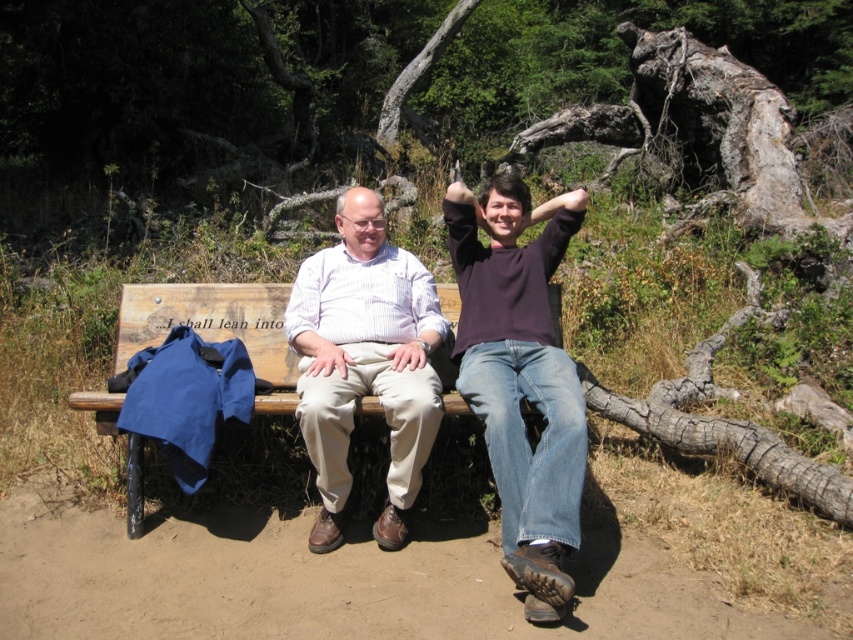
Question: Can you confirm if matte brown shirt at center is wider than light brown cotton shirt at center?

Choices:
 (A) yes
 (B) no

Answer: (A)

Question: Which of these objects is positioned farthest from the matte brown shirt at center?

Choices:
 (A) wooden bench at center
 (B) dark purple sweater at upper center

Answer: (A)

Question: Is dark purple sweater at upper center smaller than light brown cotton shirt at center?

Choices:
 (A) no
 (B) yes

Answer: (A)

Question: Which object is closer to the camera taking this photo?

Choices:
 (A) dark purple sweater at upper center
 (B) matte brown shirt at center
 (C) wooden bench at center

Answer: (A)

Question: Can you confirm if dark purple sweater at upper center is wider than wooden bench at center?

Choices:
 (A) no
 (B) yes

Answer: (A)

Question: Estimate the real-world distances between objects in this image. Which object is closer to the wooden bench at center?

Choices:
 (A) light brown cotton shirt at center
 (B) dark purple sweater at upper center
 (C) matte brown shirt at center

Answer: (A)